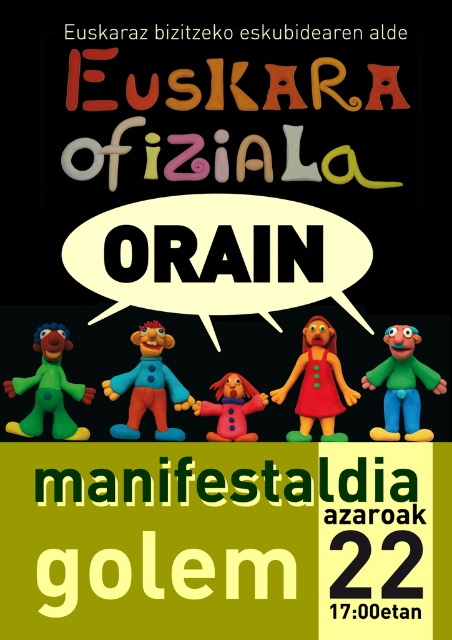
You are standing in front of the promotional poster for the Basque language event. The poster has a line of white text at the top and the word EUSKARA in bold colors below it. Where is the matte plastic clown at center located on the poster?

The matte plastic clown at center is located at the center of the poster, specifically at the 2D coordinates point (149, 385).

You are an art curator examining the promotional poster for the Basque language event. You notice two green figures in the lower half of the poster. The first is a green matte clown at center and the second is a green clay figure at left. From the perspective of someone standing in front of the poster, which of these two figures is positioned to the left?

The green clay figure at left is positioned to the left of the green matte clown at center.

You are standing at the camera position looking at the poster. There is a point marked at coordinates (x=419, y=371) on the poster. If you want to touch this point with a 15 feet long pole, will the pole be long enough?

The point at (x=419, y=371) is 180.15 feet away from the camera. Since the pole is only 15 feet long, it is not long enough to reach the point.